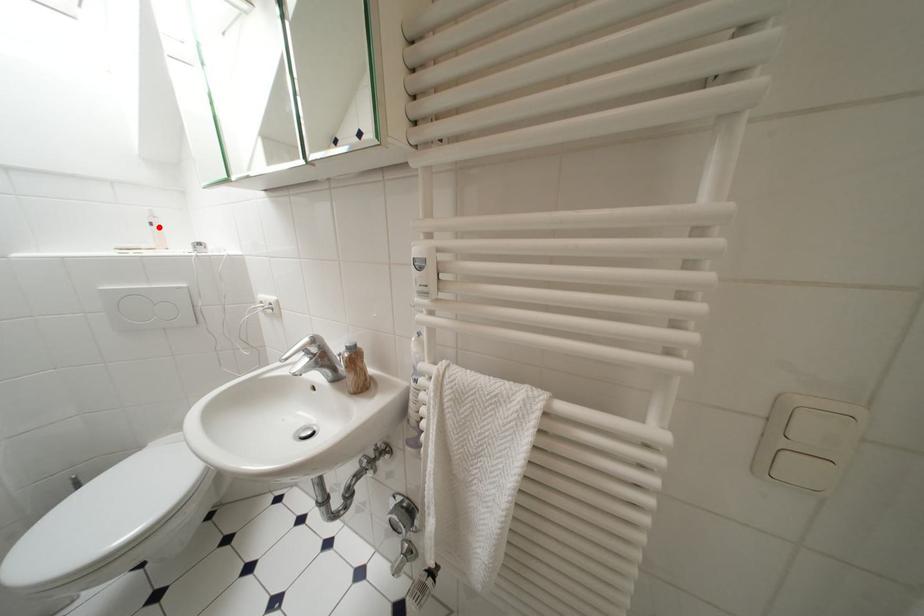
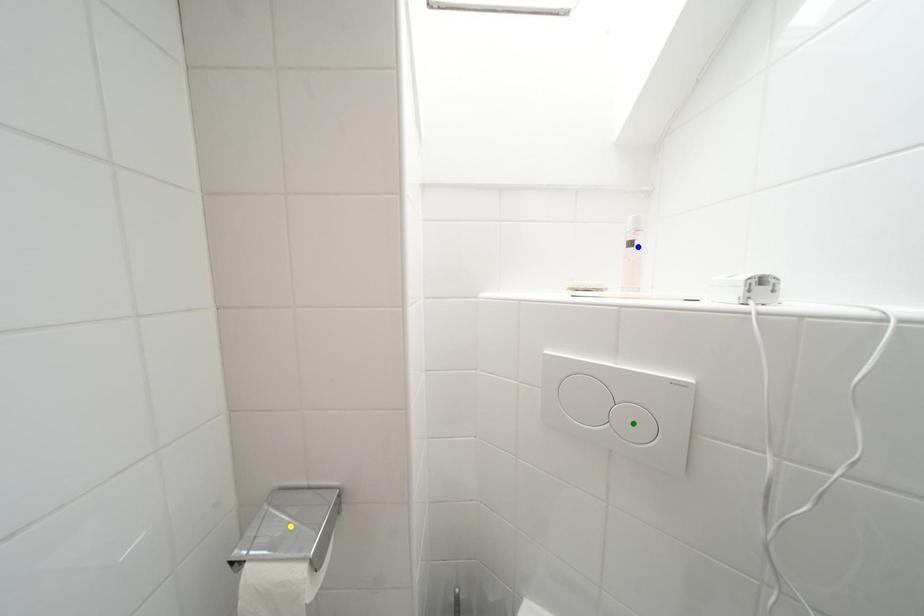
Question: I am providing you with two images of the same scene from different viewpoints. A red point is marked on the first image. You are given multiple points on the second image. Which point in image 2 is actually the same real-world point as the red point in image 1?

Choices:
 (A) green point
 (B) yellow point
 (C) blue point

Answer: (C)